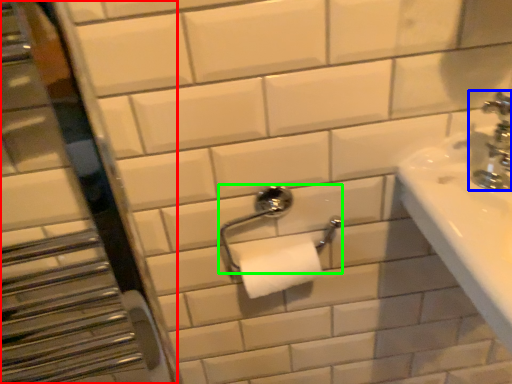
Question: Which object is the farthest from mirror (highlighted by a red box)? Choose among these: tap (highlighted by a blue box) or towel bar (highlighted by a green box).

Choices:
 (A) tap
 (B) towel bar

Answer: (A)